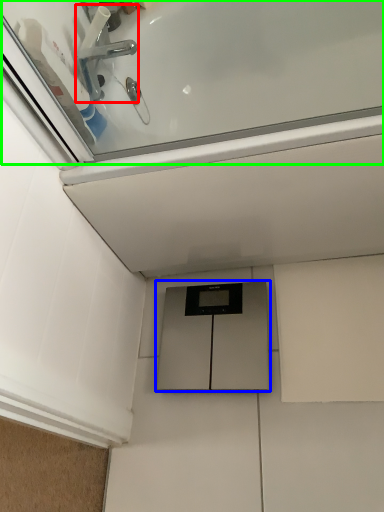
Question: Which object is positioned closest to tap (highlighted by a red box)? Select from cabinetry (highlighted by a blue box) and bath (highlighted by a green box).

Choices:
 (A) cabinetry
 (B) bath

Answer: (B)